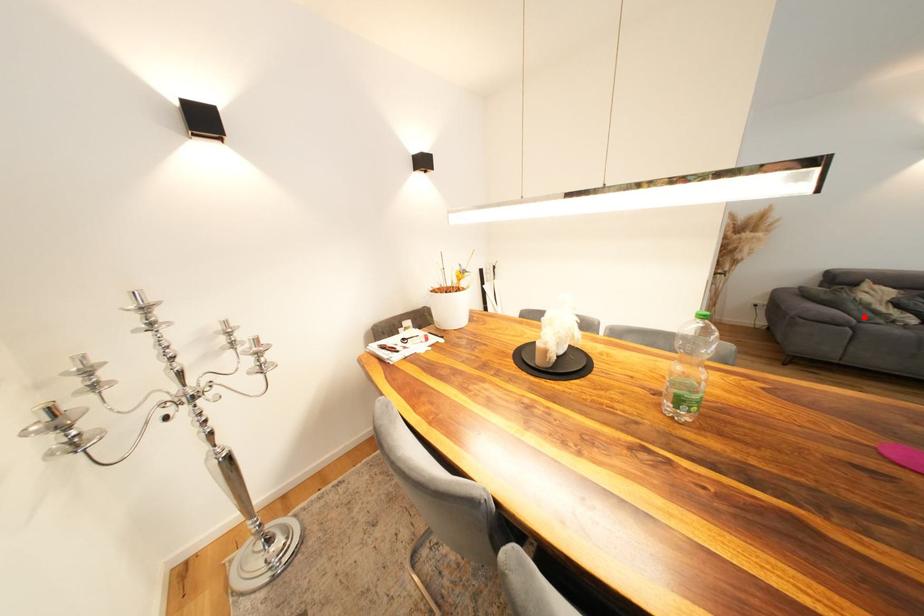
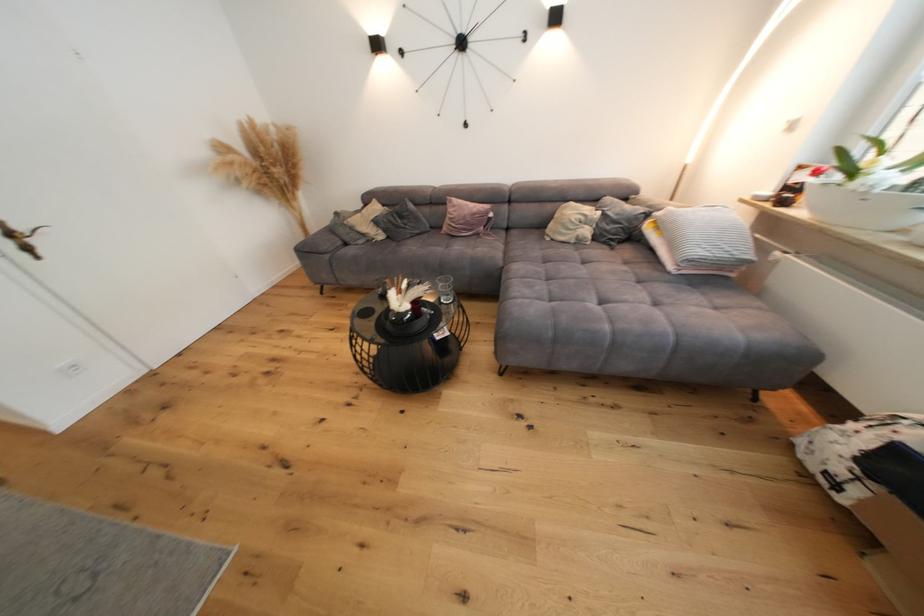
Question: I am providing you with two images of the same scene from different viewpoints. A red point is marked on the first image. At the location where the point appears in image 1, is it still visible in image 2?

Choices:
 (A) Yes
 (B) No

Answer: (A)